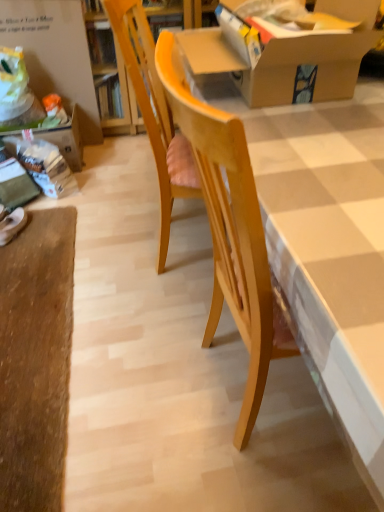
Question: From a real-world perspective, is white matte shoe at lower left positioned above or below light wood chair at center?

Choices:
 (A) above
 (B) below

Answer: (B)

Question: Does point (6, 229) appear closer or farther from the camera than point (158, 117)?

Choices:
 (A) closer
 (B) farther

Answer: (B)

Question: Which of these objects is positioned farthest from the light wood chair at center?

Choices:
 (A) wooden table at center
 (B) white matte shoe at lower left
 (C) cardboard box at upper center
 (D) white cardboard at upper left

Answer: (D)

Question: Considering the real-world distances, which object is closest to the wooden table at center?

Choices:
 (A) white cardboard at upper left
 (B) white matte shoe at lower left
 (C) cardboard box at upper center
 (D) light wood chair at center

Answer: (C)